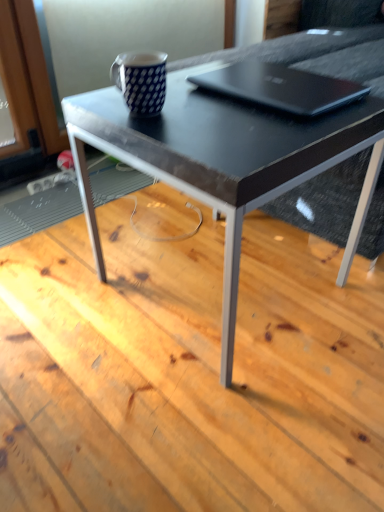
Image resolution: width=384 pixels, height=512 pixels. What are the coordinates of `space that is in front of blue dotted mug at upper center` in the screenshot? It's located at (193, 135).